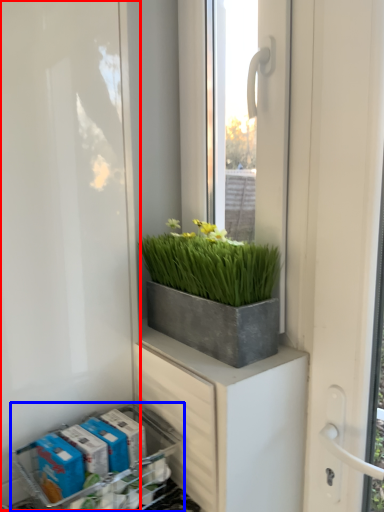
Question: Which point is further to the camera, screen door (highlighted by a red box) or flower box (highlighted by a blue box)?

Choices:
 (A) screen door
 (B) flower box

Answer: (B)